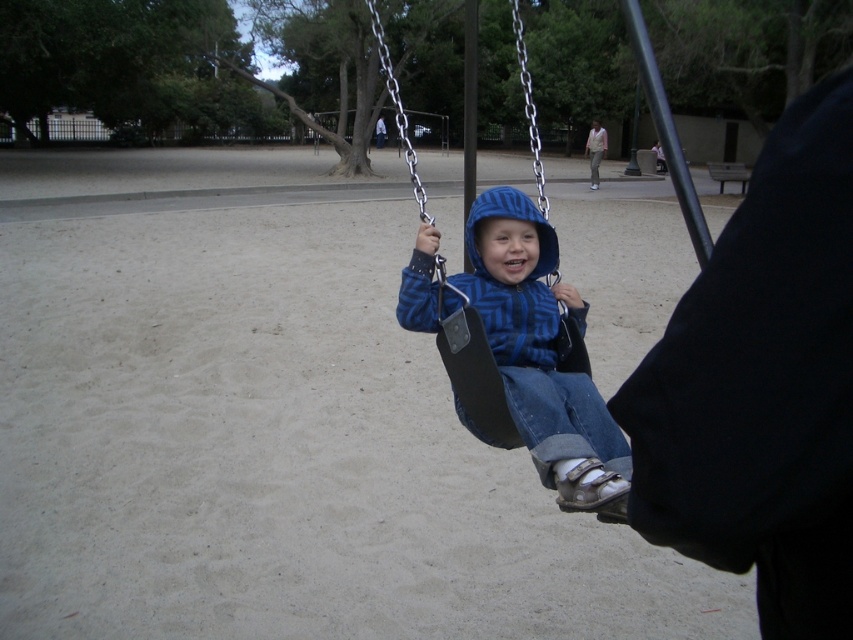
Question: Which point is farther to the camera?

Choices:
 (A) blue fleece hoodie at center
 (B) black plastic swing at center

Answer: (B)

Question: Considering the relative positions of blue fleece hoodie at center and black plastic swing at center in the image provided, where is blue fleece hoodie at center located with respect to black plastic swing at center?

Choices:
 (A) above
 (B) below

Answer: (B)

Question: Which point appears farthest from the camera in this image?

Choices:
 (A) (436, 236)
 (B) (469, 417)

Answer: (A)

Question: In this image, where is blue fleece hoodie at center located relative to black plastic swing at center?

Choices:
 (A) below
 (B) above

Answer: (A)

Question: Is blue fleece hoodie at center positioned at the back of black plastic swing at center?

Choices:
 (A) yes
 (B) no

Answer: (B)